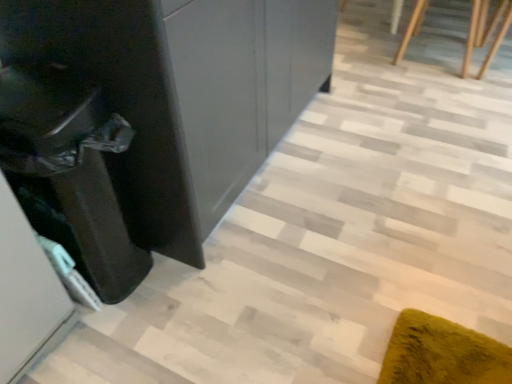
Question: Is wooden staircase at upper right not inside black glossy cabinet at left?

Choices:
 (A) yes
 (B) no

Answer: (A)

Question: Considering the relative positions of wooden staircase at upper right and black glossy cabinet at left in the image provided, is wooden staircase at upper right to the right of black glossy cabinet at left from the viewer's perspective?

Choices:
 (A) yes
 (B) no

Answer: (A)

Question: Can you confirm if wooden staircase at upper right is positioned to the left of black glossy cabinet at left?

Choices:
 (A) no
 (B) yes

Answer: (A)

Question: Can you confirm if wooden staircase at upper right is bigger than black glossy cabinet at left?

Choices:
 (A) no
 (B) yes

Answer: (B)

Question: Is the depth of wooden staircase at upper right less than that of black glossy cabinet at left?

Choices:
 (A) no
 (B) yes

Answer: (A)

Question: From the image's perspective, does wooden staircase at upper right appear higher than black glossy cabinet at left?

Choices:
 (A) yes
 (B) no

Answer: (A)

Question: From the image's perspective, is black glossy cabinet at left on top of wooden staircase at upper right?

Choices:
 (A) yes
 (B) no

Answer: (B)

Question: From a real-world perspective, is black glossy cabinet at left below wooden staircase at upper right?

Choices:
 (A) no
 (B) yes

Answer: (A)

Question: Is black glossy cabinet at left facing away from wooden staircase at upper right?

Choices:
 (A) yes
 (B) no

Answer: (B)

Question: Is black glossy cabinet at left not inside wooden staircase at upper right?

Choices:
 (A) yes
 (B) no

Answer: (A)

Question: Are black glossy cabinet at left and wooden staircase at upper right located far from each other?

Choices:
 (A) yes
 (B) no

Answer: (A)

Question: Could wooden staircase at upper right be considered to be inside black glossy cabinet at left?

Choices:
 (A) yes
 (B) no

Answer: (B)

Question: Is glossy black dresser at left thinner than wooden staircase at upper right?

Choices:
 (A) yes
 (B) no

Answer: (B)